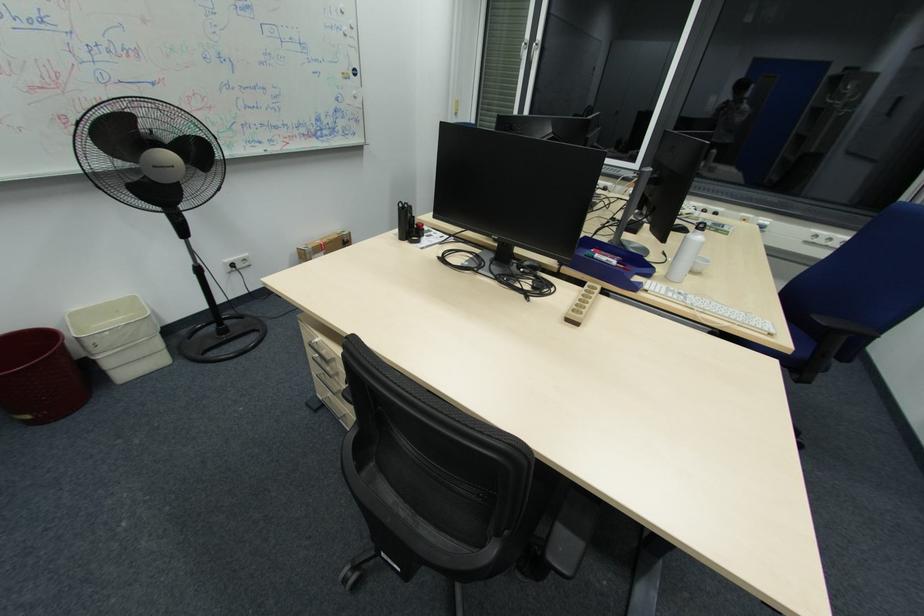
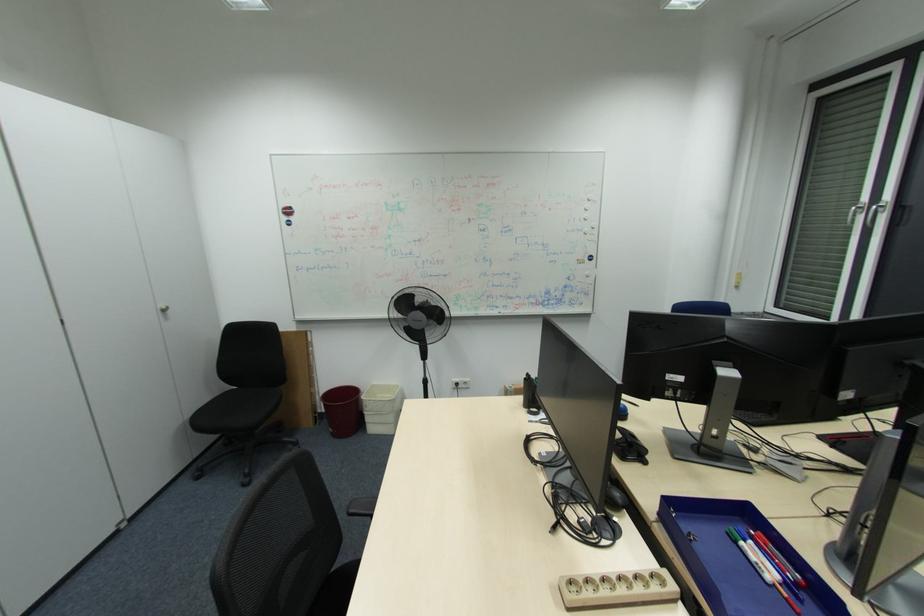
Question: The camera is either moving clockwise (left) or counter-clockwise (right) around the object. The first image is from the beginning of the video and the second image is from the end. Is the camera moving left or right when shooting the video?

Choices:
 (A) Left
 (B) Right

Answer: (B)